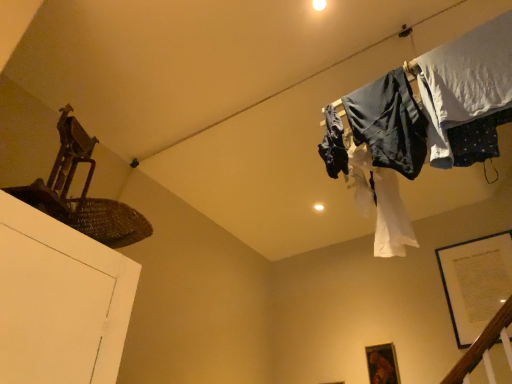
Question: Considering the relative positions of wooden frame at lower right and white fabric at upper right, arranged as the first clothing when viewed from the right, in the image provided, is wooden frame at lower right behind white fabric at upper right, arranged as the first clothing when viewed from the right,?

Choices:
 (A) yes
 (B) no

Answer: (A)

Question: Is wooden frame at lower right taller than white fabric at upper right, the 3th clothing in the left-to-right sequence?

Choices:
 (A) yes
 (B) no

Answer: (B)

Question: Can you confirm if wooden frame at lower right is wider than white fabric at upper right, arranged as the first clothing when viewed from the right?

Choices:
 (A) yes
 (B) no

Answer: (B)

Question: Does wooden frame at lower right touch white fabric at upper right, the 3th clothing in the left-to-right sequence?

Choices:
 (A) yes
 (B) no

Answer: (B)

Question: Is wooden frame at lower right oriented away from white fabric at upper right, the 3th clothing in the left-to-right sequence?

Choices:
 (A) yes
 (B) no

Answer: (B)

Question: In terms of width, does dark blue fabric at upper right, the 2th clothing positioned from the left, look wider or thinner when compared to white fabric at upper right, arranged as the first clothing when viewed from the right?

Choices:
 (A) wide
 (B) thin

Answer: (B)

Question: Is dark blue fabric at upper right, the second clothing when ordered from right to left, bigger or smaller than white fabric at upper right, arranged as the first clothing when viewed from the right?

Choices:
 (A) big
 (B) small

Answer: (B)

Question: Considering the positions of point (384, 160) and point (481, 51), is point (384, 160) closer or farther from the camera than point (481, 51)?

Choices:
 (A) farther
 (B) closer

Answer: (A)

Question: In terms of height, does dark blue fabric at upper right, the second clothing when ordered from right to left, look taller or shorter compared to white fabric at upper right, arranged as the first clothing when viewed from the right?

Choices:
 (A) tall
 (B) short

Answer: (B)

Question: From the image's perspective, is dark blue fabric at upper right, acting as the first clothing starting from the left, above or below white fabric at upper right, the 3th clothing in the left-to-right sequence?

Choices:
 (A) above
 (B) below

Answer: (B)

Question: Considering their positions, is dark blue fabric at upper right, which ranks as the 3th clothing in right-to-left order, located in front of or behind white fabric at upper right, arranged as the first clothing when viewed from the right?

Choices:
 (A) front
 (B) behind

Answer: (B)

Question: Visually, is dark blue fabric at upper right, which ranks as the 3th clothing in right-to-left order, positioned to the left or to the right of white fabric at upper right, the 3th clothing in the left-to-right sequence?

Choices:
 (A) left
 (B) right

Answer: (A)

Question: Considering the positions of point (336, 130) and point (430, 160), is point (336, 130) closer or farther from the camera than point (430, 160)?

Choices:
 (A) farther
 (B) closer

Answer: (A)

Question: Which is correct: wooden frame at lower right is inside dark blue fabric at upper right, the 2th clothing positioned from the left, or outside of it?

Choices:
 (A) inside
 (B) outside

Answer: (B)

Question: In terms of size, does wooden frame at lower right appear bigger or smaller than dark blue fabric at upper right, the second clothing when ordered from right to left?

Choices:
 (A) big
 (B) small

Answer: (B)